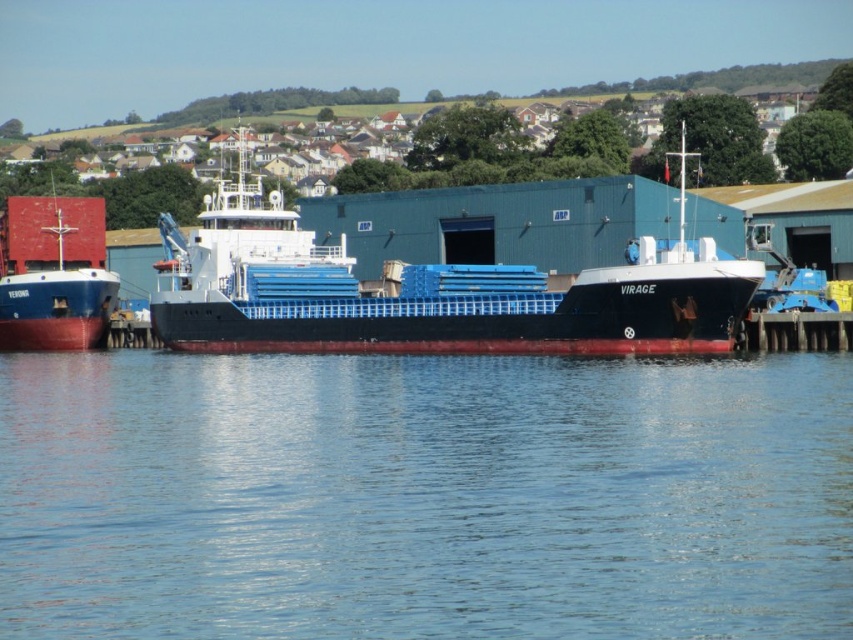
Question: Is transparent blue water at center wider than matte red ship at left?

Choices:
 (A) no
 (B) yes

Answer: (B)

Question: Observing the image, what is the correct spatial positioning of blue matte cargo ship at center in reference to matte red ship at left?

Choices:
 (A) below
 (B) above

Answer: (B)

Question: Which is farther from the transparent blue water at center?

Choices:
 (A) matte red ship at left
 (B) blue matte cargo ship at center

Answer: (A)

Question: Which of the following is the closest to the observer?

Choices:
 (A) transparent blue water at center
 (B) matte red ship at left
 (C) blue matte cargo ship at center

Answer: (A)

Question: From the image, what is the correct spatial relationship of transparent blue water at center in relation to matte red ship at left?

Choices:
 (A) above
 (B) below

Answer: (B)

Question: Which of the following is the farthest from the observer?

Choices:
 (A) (91, 214)
 (B) (350, 262)

Answer: (A)